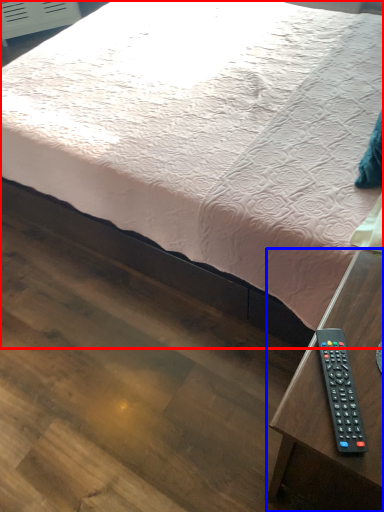
Question: Which object is further to the camera taking this photo, bed (highlighted by a red box) or table (highlighted by a blue box)?

Choices:
 (A) bed
 (B) table

Answer: (A)